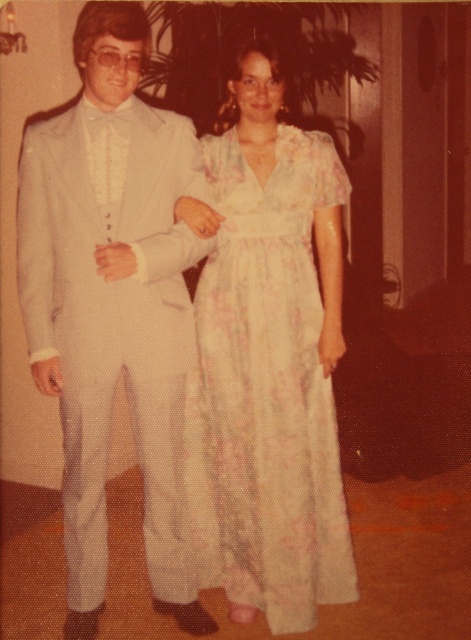
Question: Does matte white suit at left lie in front of floral chiffon dress at center?

Choices:
 (A) no
 (B) yes

Answer: (B)

Question: Is matte white suit at left smaller than floral chiffon dress at center?

Choices:
 (A) no
 (B) yes

Answer: (A)

Question: Which point is closer to the camera?

Choices:
 (A) (146, 164)
 (B) (301, 285)

Answer: (A)

Question: Which object appears farthest from the camera in this image?

Choices:
 (A) matte white suit at left
 (B) floral chiffon dress at center

Answer: (B)

Question: Can you confirm if matte white suit at left is smaller than floral chiffon dress at center?

Choices:
 (A) yes
 (B) no

Answer: (B)